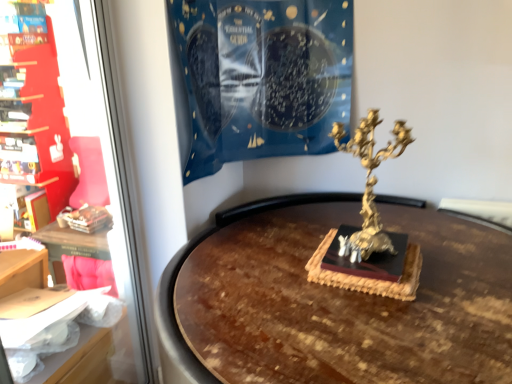
Question: From a real-world perspective, is matte red bookshelf at left physically located above or below matte red bookshelf at left?

Choices:
 (A) below
 (B) above

Answer: (A)

Question: Looking at the image, does matte red bookshelf at left seem bigger or smaller compared to matte red bookshelf at left?

Choices:
 (A) big
 (B) small

Answer: (B)

Question: Estimate the real-world distances between objects in this image. Which object is farther from the black matte book at center?

Choices:
 (A) gold metallic candelabra at center-right
 (B) blue fabric at upper center
 (C) matte red bookshelf at left
 (D) matte red bookshelf at left

Answer: (C)

Question: Based on their relative distances, which object is nearer to the gold metallic candelabra at center-right?

Choices:
 (A) matte red bookshelf at left
 (B) matte red bookshelf at left
 (C) black matte book at center
 (D) blue fabric at upper center

Answer: (C)